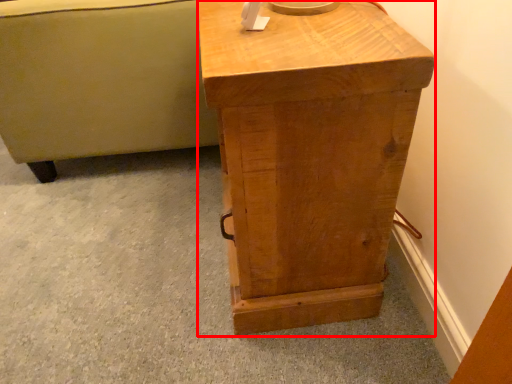
Question: From the image's perspective, where is nightstand (annotated by the red box) located relative to furniture?

Choices:
 (A) above
 (B) below

Answer: (B)